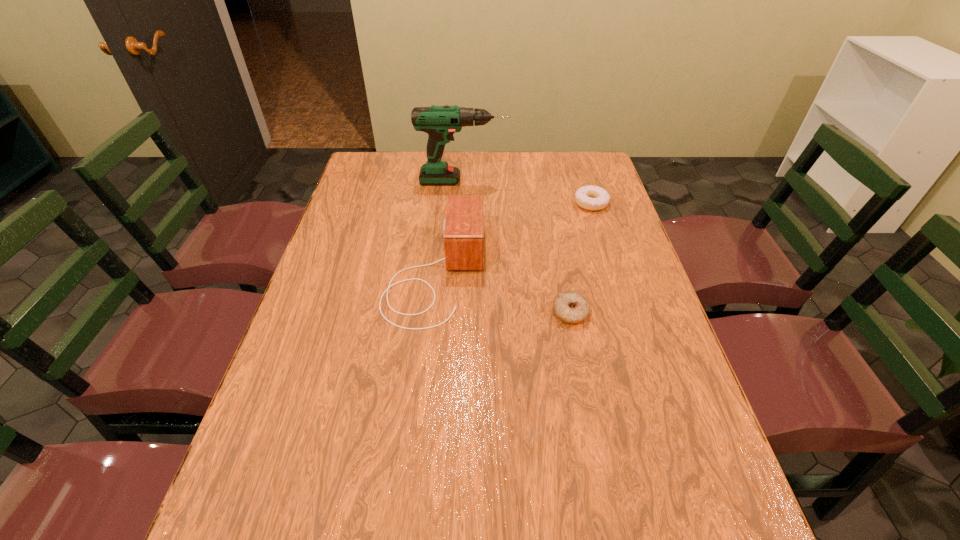
The width and height of the screenshot is (960, 540). I want to click on free location located 0.060m on the right of the nearer doughnut, so click(612, 313).

Locate an element on the screen. This screenshot has height=540, width=960. object that is at the far edge is located at coordinates (440, 122).

Locate an element on the screen. The height and width of the screenshot is (540, 960). object that is at the right edge is located at coordinates (593, 198).

You are a GUI agent. You are given a task and a screenshot of the screen. Output one action in this format:
    pyautogui.click(x=<x>, y=<y>)
    Task: Click on the free space at the far edge of the desktop
    This screenshot has width=960, height=540.
    Given the screenshot: What is the action you would take?
    pyautogui.click(x=486, y=165)

At what (x,y) coordinates should I click in order to perform the action: click on vacant space at the left edge. Please return your answer as a coordinate pair (x, y). Looking at the image, I should click on (280, 393).

Locate an element on the screen. vacant space at the right edge of the desktop is located at coordinates (619, 298).

The height and width of the screenshot is (540, 960). What are the coordinates of `free space at the far left corner of the desktop` in the screenshot? It's located at (363, 152).

The height and width of the screenshot is (540, 960). In order to click on vacant space at the far right corner of the desktop in this screenshot , I will do `click(564, 165)`.

Find the location of a particular element. The image size is (960, 540). unoccupied area between the left doughnut and the tallest object is located at coordinates (516, 247).

The width and height of the screenshot is (960, 540). Find the location of `free space between the radio receiver and the right doughnut`. free space between the radio receiver and the right doughnut is located at coordinates (514, 238).